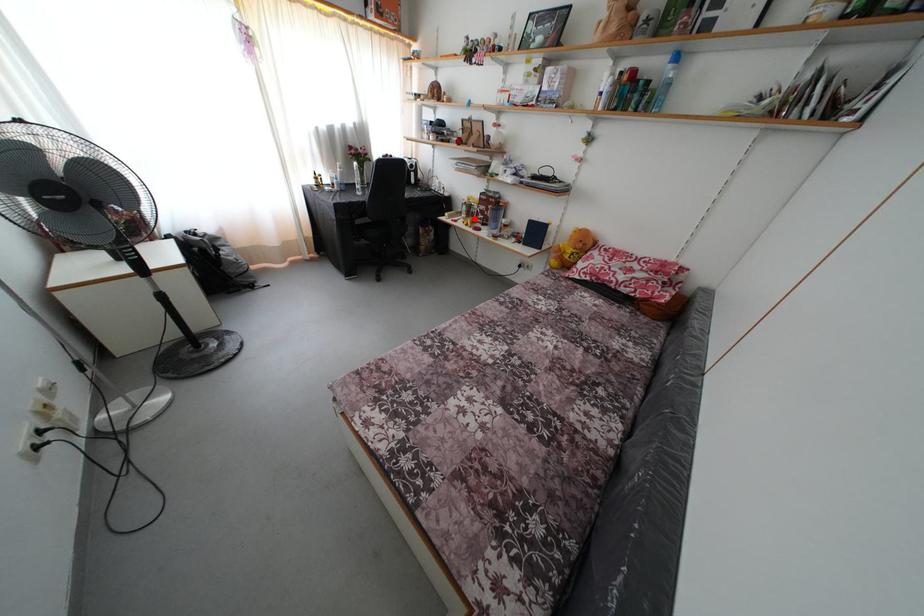
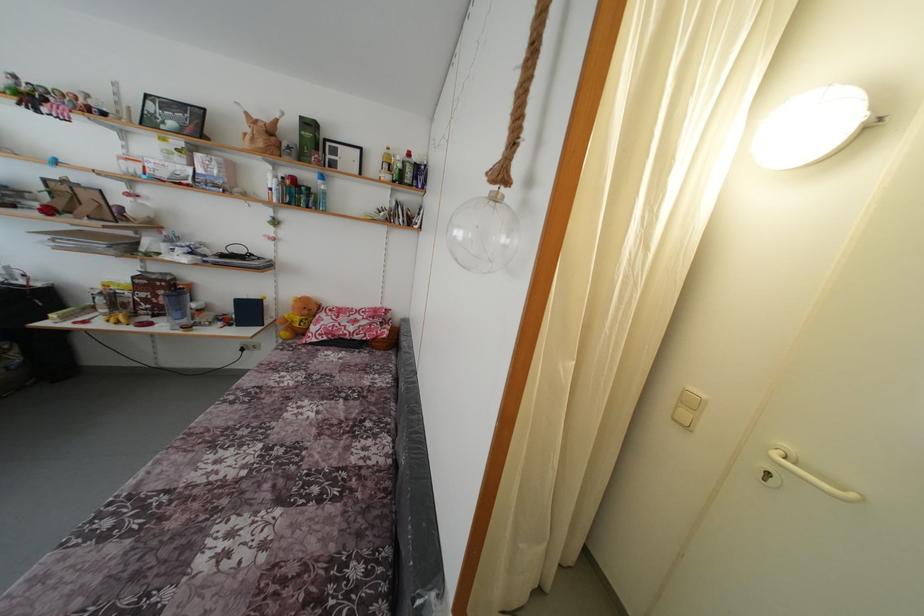
In the second image, find the point that corresponds to the highlighted location in the first image.

(120, 310)